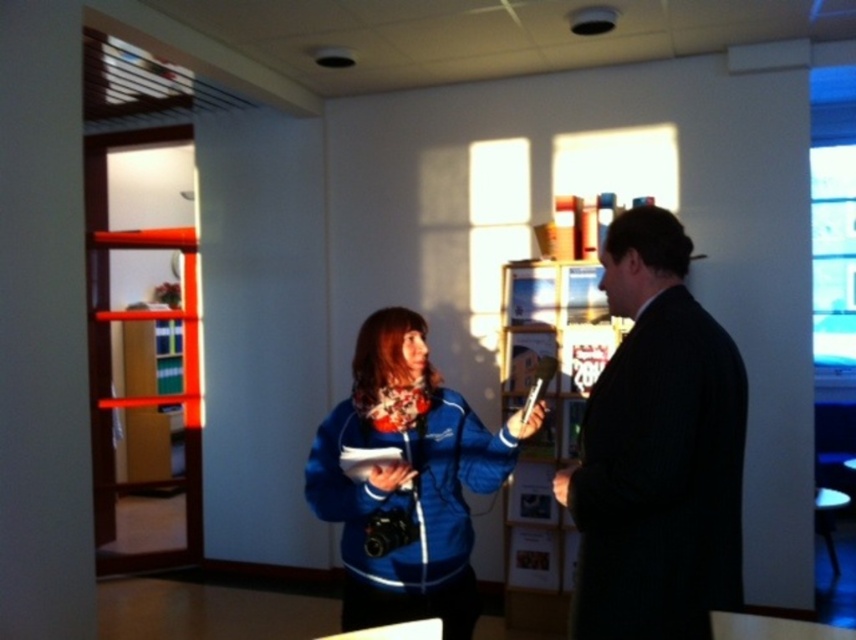
Question: Which object is the farthest from the dark suit at center?

Choices:
 (A) blue fleece jacket at center
 (B) blue fabric jacket at center
 (C) wooden bookshelf at center

Answer: (C)

Question: Which object is the farthest from the blue fleece jacket at center?

Choices:
 (A) wooden bookshelf at center
 (B) blue fabric jacket at center

Answer: (A)

Question: Does blue fleece jacket at center lie in front of wooden bookshelf at center?

Choices:
 (A) no
 (B) yes

Answer: (B)

Question: Can you confirm if dark suit at center is smaller than wooden bookshelf at center?

Choices:
 (A) no
 (B) yes

Answer: (B)

Question: Among these objects, which one is nearest to the camera?

Choices:
 (A) blue fleece jacket at center
 (B) wooden bookshelf at center

Answer: (A)

Question: Is blue fabric jacket at center above blue fleece jacket at center?

Choices:
 (A) yes
 (B) no

Answer: (A)